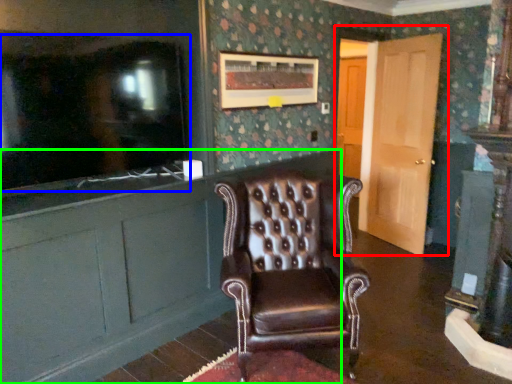
Question: Considering the real-world distances, which object is farthest from door (highlighted by a red box)? tv show (highlighted by a blue box) or cabinetry (highlighted by a green box)?

Choices:
 (A) tv show
 (B) cabinetry

Answer: (A)